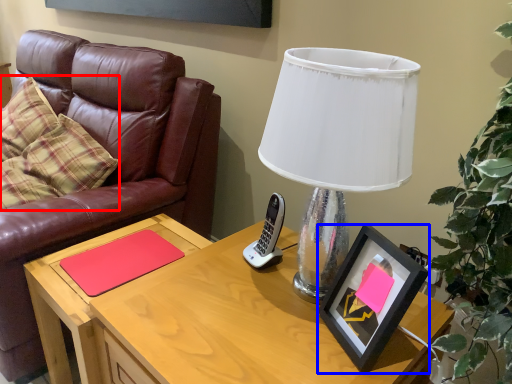
Question: Which of the following is the closest to the observer, pillow (highlighted by a red box) or picture frame (highlighted by a blue box)?

Choices:
 (A) pillow
 (B) picture frame

Answer: (B)